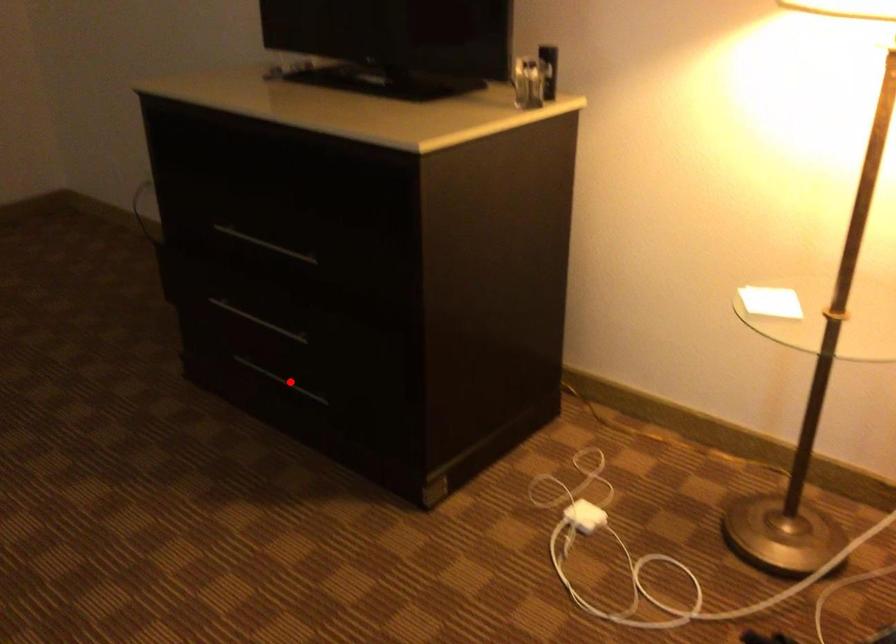
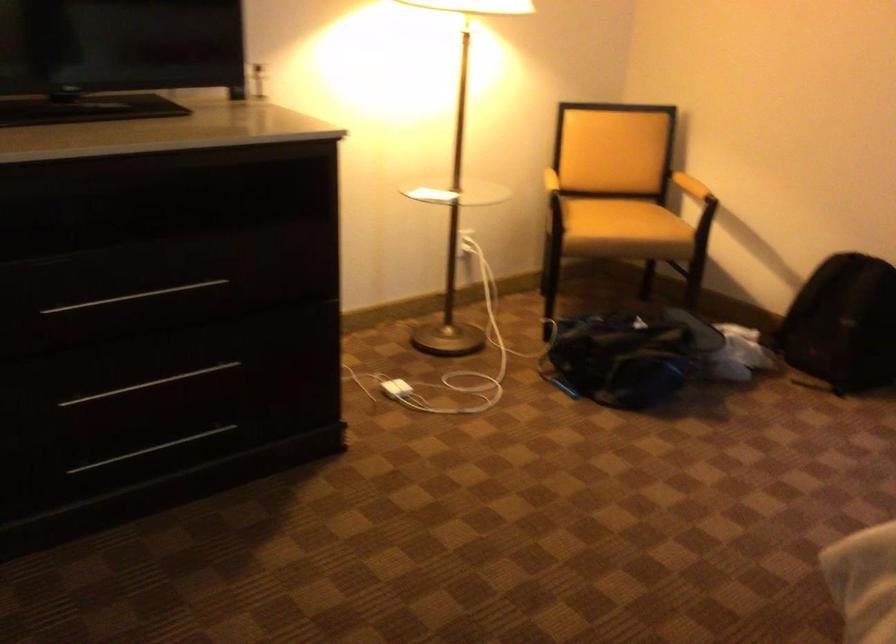
Question: I am providing you with two images of the same scene from different viewpoints. A red point is shown in image1. For the corresponding object point in image2, is it positioned nearer or farther from the camera?

Choices:
 (A) Nearer
 (B) Farther

Answer: (A)